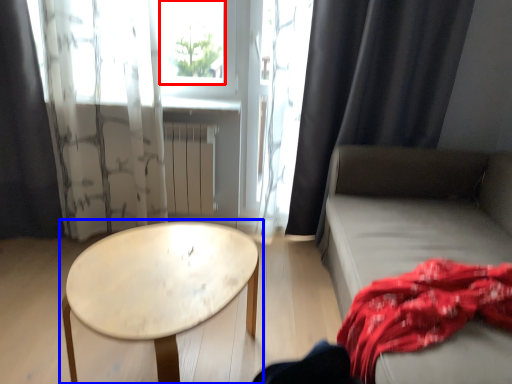
Question: Which point is closer to the camera, window screen (highlighted by a red box) or table (highlighted by a blue box)?

Choices:
 (A) window screen
 (B) table

Answer: (B)